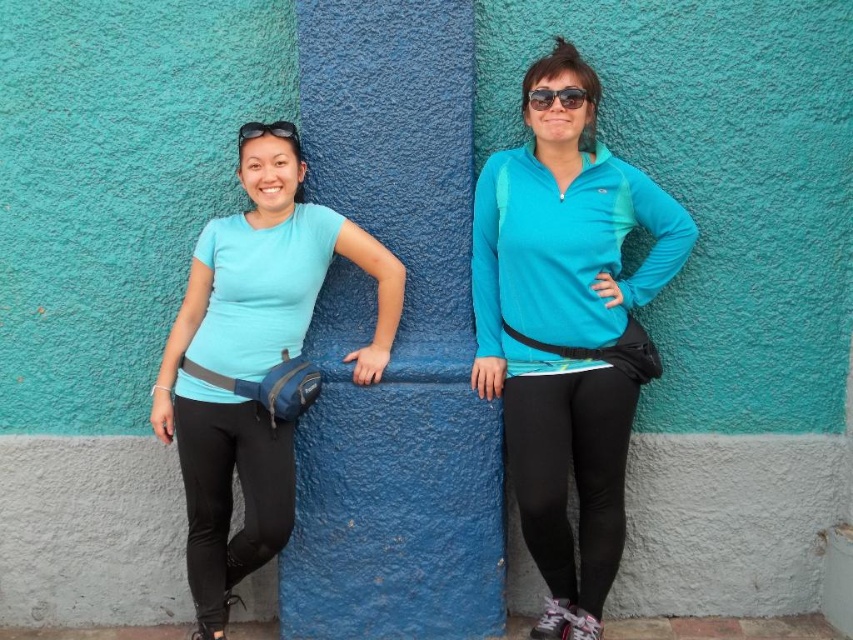
Consider the image. You are a photographer trying to capture the two people in the image. You notice a specific point at coordinates point (x=253, y=364). Which object from the scene is this point located on?

The point (x=253, y=364) is located on the matte blue shirt at left.

In the scene shown: Based on the scene description, where is the matte blue shirt at left located in terms of its 2D coordinates?

The matte blue shirt at left is located at the 2D coordinates of point (253, 364).